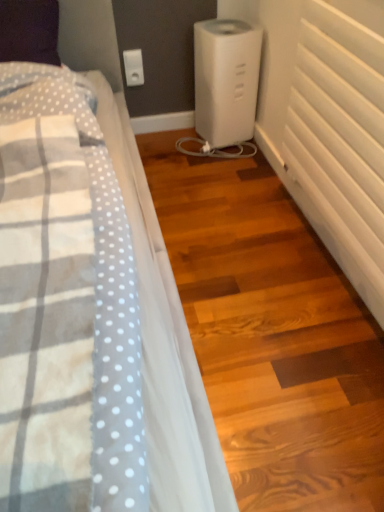
What do you see at coordinates (342, 138) in the screenshot? I see `white matte radiator at right` at bounding box center [342, 138].

The width and height of the screenshot is (384, 512). In order to click on white matte radiator at right in this screenshot , I will do `click(342, 138)`.

The height and width of the screenshot is (512, 384). What do you see at coordinates (226, 80) in the screenshot?
I see `white plastic humidifier at center` at bounding box center [226, 80].

This screenshot has height=512, width=384. What are the coordinates of `white plastic electric outlet at upper center` in the screenshot? It's located at (133, 67).

Considering the positions of points (135, 60) and (241, 89), is point (135, 60) farther from camera compared to point (241, 89)?

Yes, point (135, 60) is behind point (241, 89).

Are white plastic electric outlet at upper center and white plastic humidifier at center making contact?

No, white plastic electric outlet at upper center is not in contact with white plastic humidifier at center.

How many degrees apart are the facing directions of white plastic electric outlet at upper center and white plastic humidifier at center?

They differ by 12.2 degrees in their facing directions.

Identify the location of electric outlet behind the white plastic humidifier at center. The image size is (384, 512). (133, 67).

Is the surface of white plastic humidifier at center in direct contact with white matte radiator at right?

No.

Considering the sizes of objects white plastic humidifier at center and white matte radiator at right in the image provided, who is taller, white plastic humidifier at center or white matte radiator at right?

white matte radiator at right is taller.

This screenshot has width=384, height=512. In the image, there is a white plastic humidifier at center. Find the location of `radiator below it (from the image's perspective)`. radiator below it (from the image's perspective) is located at coordinates (342, 138).

Considering the sizes of objects white plastic humidifier at center and white matte radiator at right in the image provided, who is wider, white plastic humidifier at center or white matte radiator at right?

white plastic humidifier at center is wider.

Looking at this image, is white plastic electric outlet at upper center shorter than white matte radiator at right?

Yes.

From a real-world perspective, is white plastic electric outlet at upper center located beneath white matte radiator at right?

Correct, in the physical world, white plastic electric outlet at upper center is lower than white matte radiator at right.

How different are the orientations of white plastic electric outlet at upper center and white matte radiator at right in degrees?

white plastic electric outlet at upper center and white matte radiator at right are facing 90.3 degrees away from each other.

Is white plastic humidifier at center turned away from white plastic electric outlet at upper center?

white plastic humidifier at center is not turned away from white plastic electric outlet at upper center.

Would you say white plastic humidifier at center is outside white plastic electric outlet at upper center?

Yes.

From a real-world perspective, is white matte radiator at right physically below white plastic humidifier at center?

Incorrect, from a real-world perspective, white matte radiator at right is higher than white plastic humidifier at center.

Which is more to the left, white matte radiator at right or white plastic humidifier at center?

white plastic humidifier at center is more to the left.

Is white matte radiator at right facing towards white plastic humidifier at center?

No, white matte radiator at right is not oriented towards white plastic humidifier at center.

In the scene shown: Can we say white matte radiator at right lies outside white plastic humidifier at center?

white matte radiator at right lies outside white plastic humidifier at center's area.

Considering the positions of objects white matte radiator at right and white plastic electric outlet at upper center in the image provided, who is more to the left, white matte radiator at right or white plastic electric outlet at upper center?

Positioned to the left is white plastic electric outlet at upper center.

In terms of height, does white matte radiator at right look taller or shorter compared to white plastic electric outlet at upper center?

Clearly, white matte radiator at right is taller compared to white plastic electric outlet at upper center.

Which object is thinner, white matte radiator at right or white plastic electric outlet at upper center?

With smaller width is white plastic electric outlet at upper center.

Is white matte radiator at right positioned in front of white plastic electric outlet at upper center?

Yes, it is.

Where is `home appliance below the white plastic electric outlet at upper center (from the image's perspective)`? home appliance below the white plastic electric outlet at upper center (from the image's perspective) is located at coordinates (226, 80).

Find the location of `radiator above the white plastic humidifier at center (from a real-world perspective)`. radiator above the white plastic humidifier at center (from a real-world perspective) is located at coordinates (342, 138).

From the image, which object appears to be nearer to white plastic humidifier at center, white matte radiator at right or white plastic electric outlet at upper center?

Among the two, white plastic electric outlet at upper center is located nearer to white plastic humidifier at center.

Looking at the image, which one is located closer to white matte radiator at right, white plastic humidifier at center or white plastic electric outlet at upper center?

Among the two, white plastic humidifier at center is located nearer to white matte radiator at right.

Looking at the image, which one is located further to white plastic humidifier at center, white plastic electric outlet at upper center or white matte radiator at right?

white matte radiator at right lies further to white plastic humidifier at center than the other object.

When comparing their distances from white plastic electric outlet at upper center, does white matte radiator at right or white plastic humidifier at center seem closer?

white plastic humidifier at center.

Looking at the image, which one is located closer to white matte radiator at right, white plastic electric outlet at upper center or white plastic humidifier at center?

white plastic humidifier at center.

Estimate the real-world distances between objects in this image. Which object is closer to white plastic electric outlet at upper center, white plastic humidifier at center or white matte radiator at right?

white plastic humidifier at center is positioned closer to the anchor white plastic electric outlet at upper center.

Where is `home appliance between white matte radiator at right and white plastic electric outlet at upper center along the z-axis`? The height and width of the screenshot is (512, 384). home appliance between white matte radiator at right and white plastic electric outlet at upper center along the z-axis is located at coordinates (226, 80).